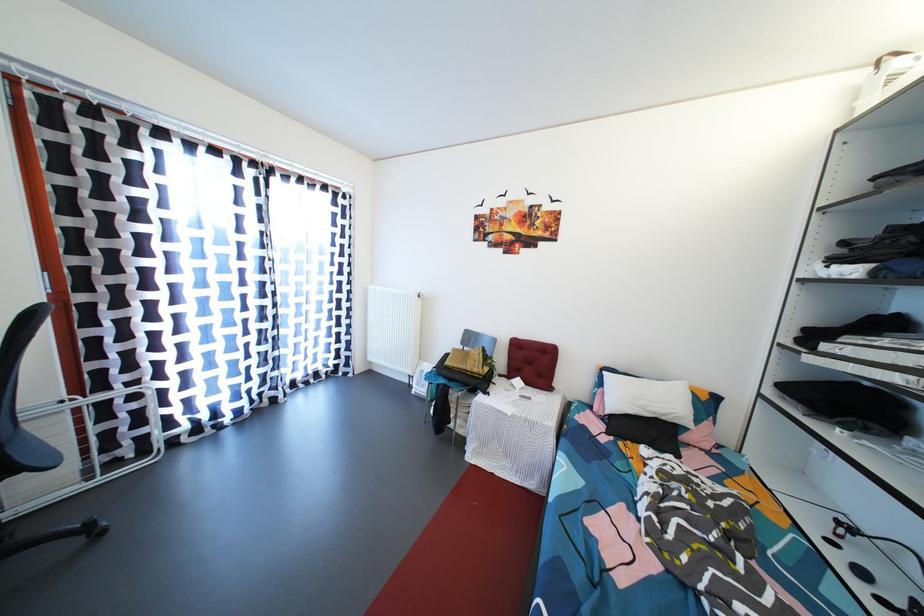
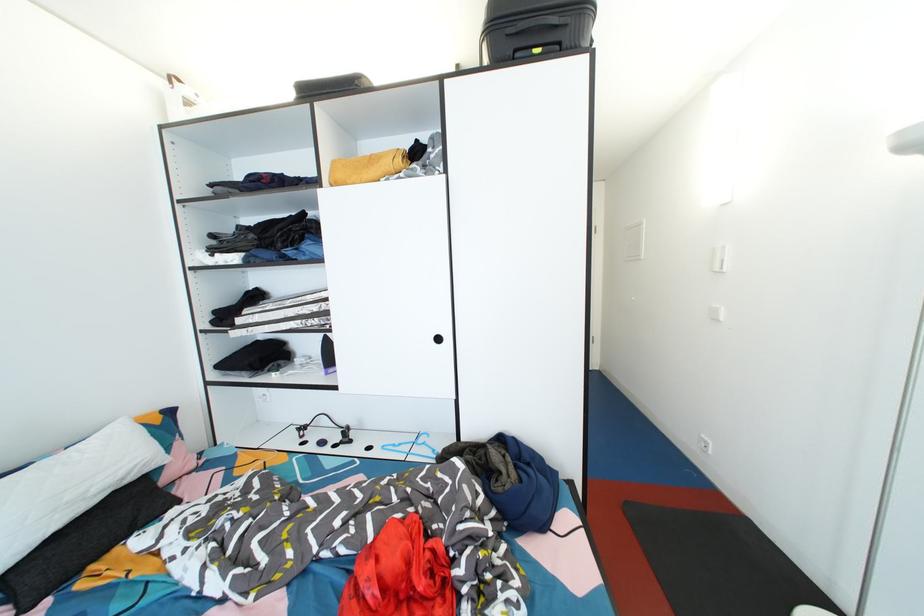
The point at (671,416) is marked in the first image. Where is the corresponding point in the second image?

(128, 477)